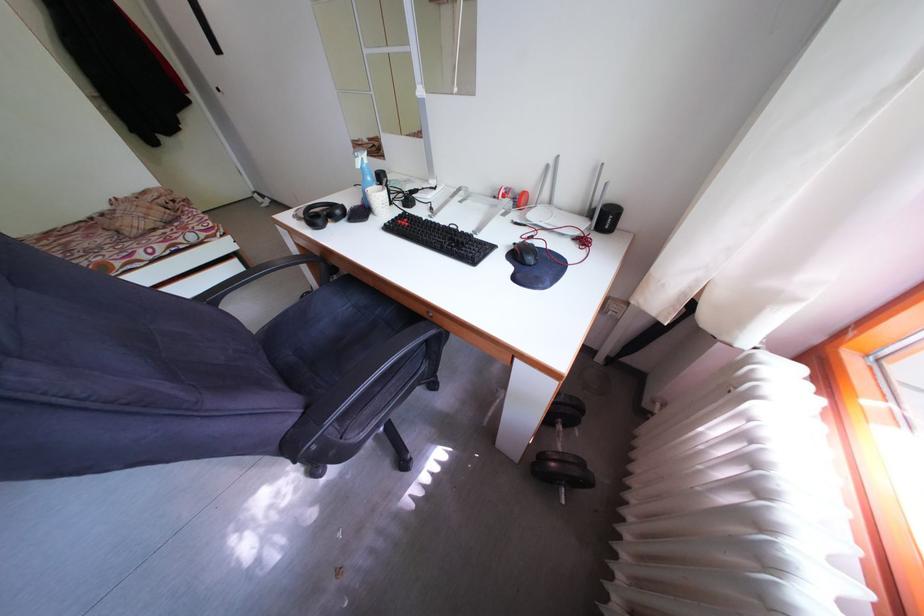
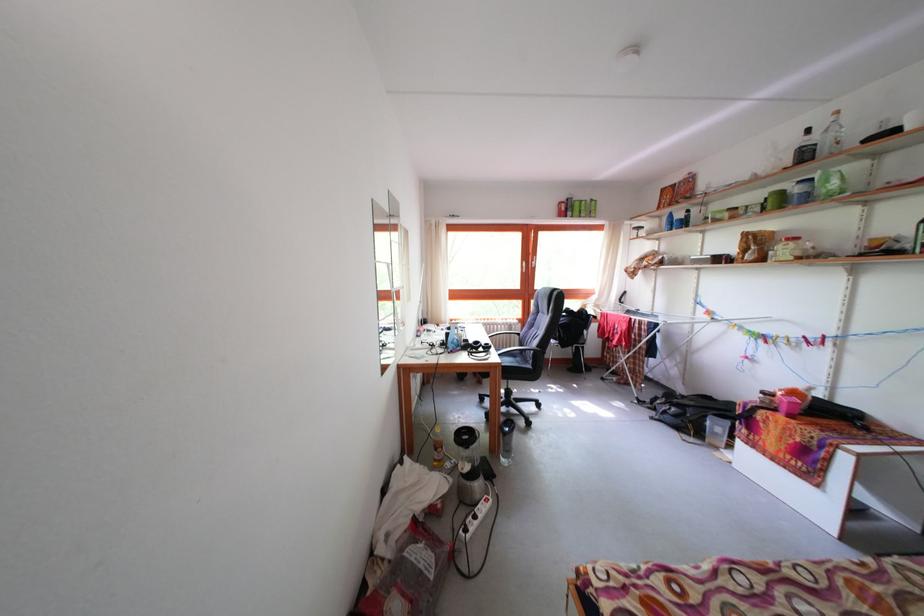
The point at (321, 223) is marked in the first image. Where is the corresponding point in the second image?

(495, 353)